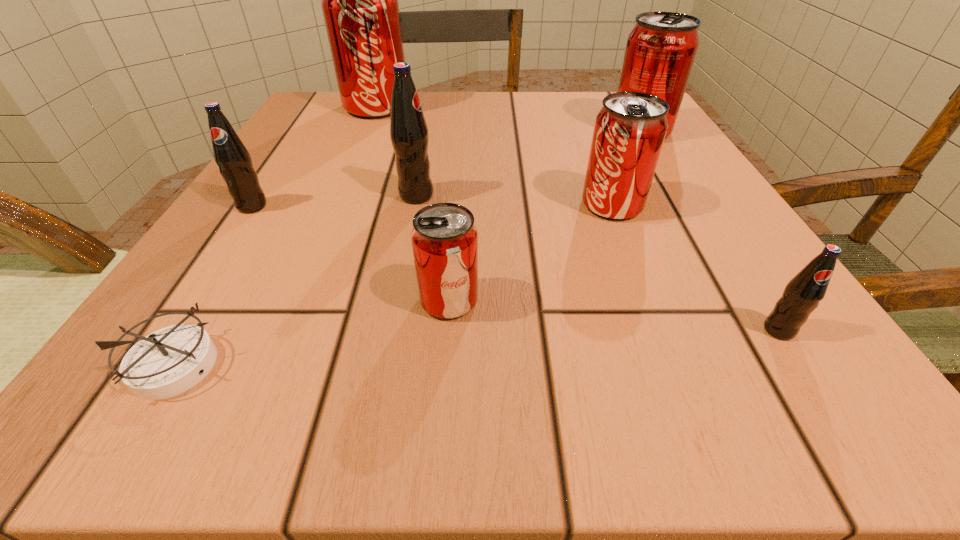
Locate an element on the screen. Image resolution: width=960 pixels, height=540 pixels. the tallest pop is located at coordinates (359, 0).

Identify the location of the leftmost red pop soda. The width and height of the screenshot is (960, 540). (359, 0).

Find the location of a particular element. the fifth pop from right to left is located at coordinates (409, 135).

Locate an element on the screen. the fifth object from right to left is located at coordinates (409, 135).

Locate an element on the screen. Image resolution: width=960 pixels, height=540 pixels. the rightmost red pop soda is located at coordinates (661, 48).

I want to click on the sixth object from left to right, so click(629, 131).

Identify the location of the fifth pop from left to right. The image size is (960, 540). (629, 131).

At what (x,y) coordinates should I click in order to perform the action: click on the second biggest black pop. Please return your answer as a coordinate pair (x, y). The height and width of the screenshot is (540, 960). Looking at the image, I should click on (234, 161).

Identify the location of the leftmost pop. (234, 161).

I want to click on the fourth pop from left to right, so click(x=444, y=238).